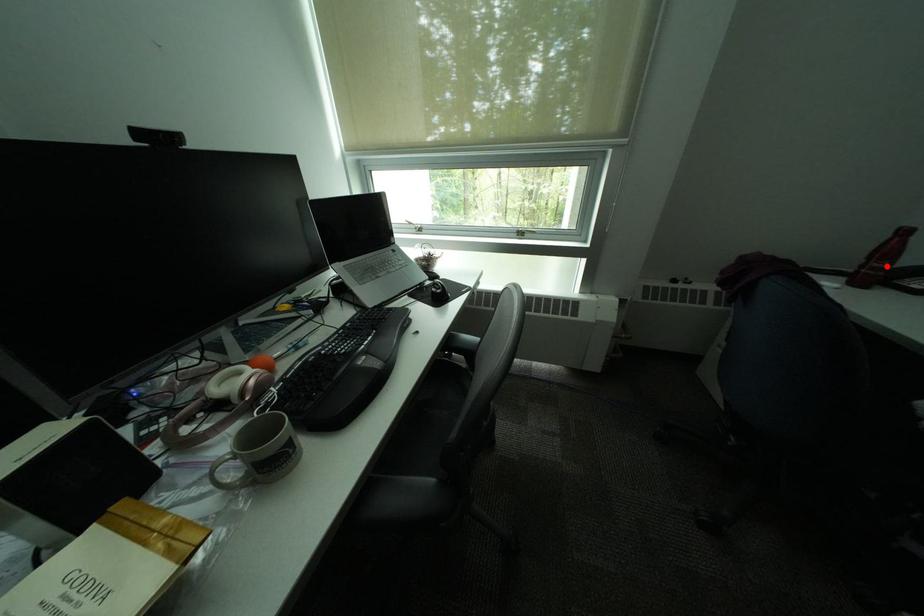
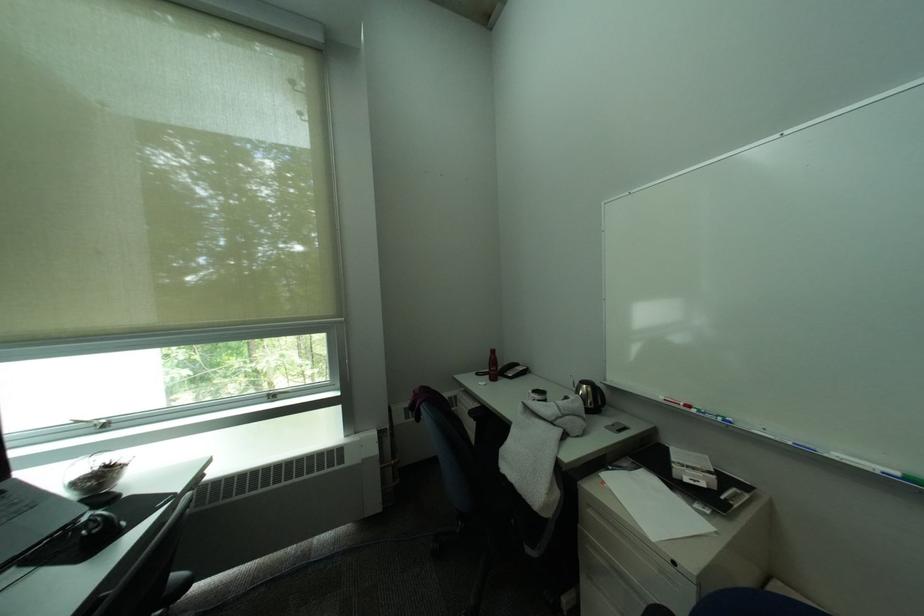
Question: I am providing you with two images of the same scene from different viewpoints. A red point is shown in image1. For the corresponding object point in image2, is it positioned nearer or farther from the camera?

Choices:
 (A) Nearer
 (B) Farther

Answer: (B)